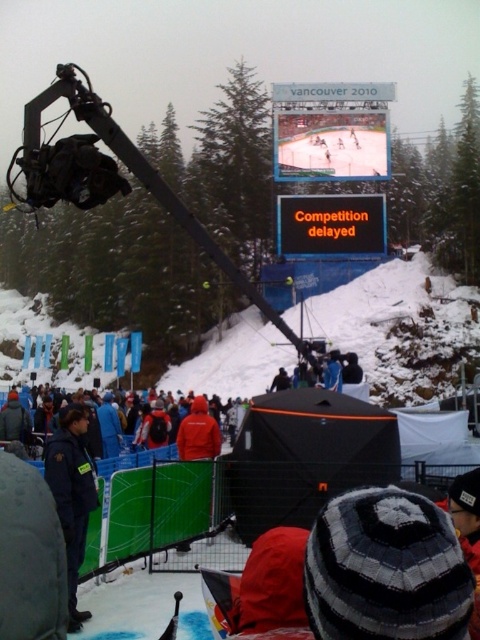
Question: Can you confirm if orange led sign at upper center is positioned above red jacket at center?

Choices:
 (A) no
 (B) yes

Answer: (B)

Question: Does orange led sign at upper center appear under red jacket at center?

Choices:
 (A) no
 (B) yes

Answer: (A)

Question: Which point is farther to the camera?

Choices:
 (A) (313, 212)
 (B) (112, 410)

Answer: (A)

Question: Among these points, which one is farthest from the camera?

Choices:
 (A) (288, 237)
 (B) (216, 445)

Answer: (A)

Question: Does orange led sign at upper center come behind red jacket at center?

Choices:
 (A) no
 (B) yes

Answer: (B)